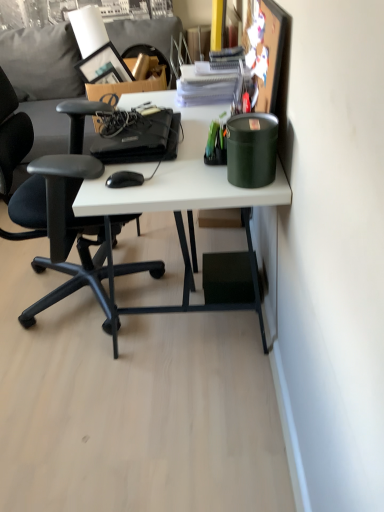
At what (x,y) coordinates should I click in order to perform the action: click on vacant area that is in front of black matte laptop at center. Please return your answer as a coordinate pair (x, y). This screenshot has height=512, width=384. Looking at the image, I should click on (152, 177).